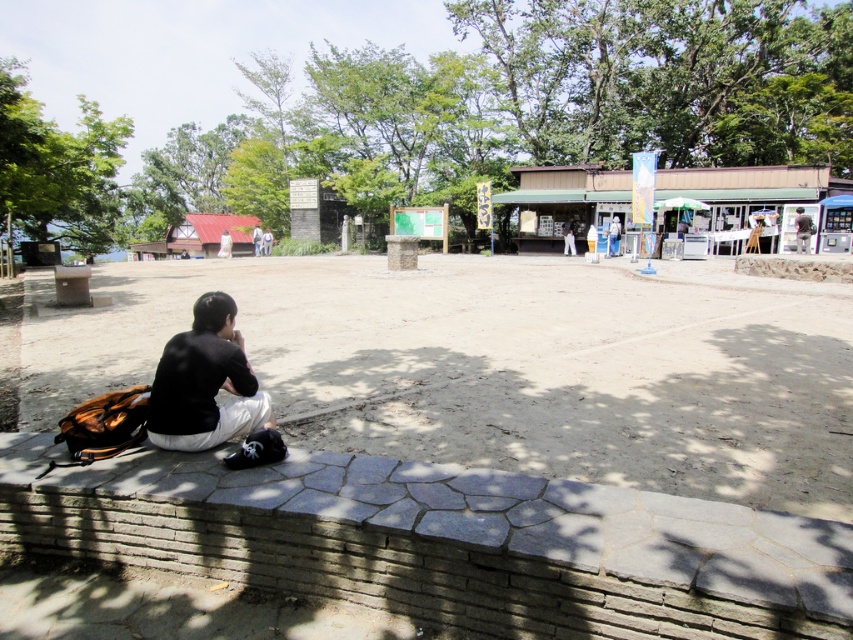
In the scene shown: Does brick at lower left have a greater width compared to black matte shirt at lower left?

Correct, the width of brick at lower left exceeds that of black matte shirt at lower left.

Does brick at lower left have a lesser width compared to black matte shirt at lower left?

In fact, brick at lower left might be wider than black matte shirt at lower left.

What do you see at coordinates (440, 541) in the screenshot? Image resolution: width=853 pixels, height=640 pixels. I see `brick at lower left` at bounding box center [440, 541].

Locate an element on the screen. The image size is (853, 640). brick at lower left is located at coordinates (440, 541).

This screenshot has height=640, width=853. What are the coordinates of `black matte shirt at lower left` in the screenshot? It's located at (207, 385).

Who is more distant from viewer, (x=189, y=342) or (x=811, y=230)?

Positioned behind is point (x=811, y=230).

At what (x,y) coordinates should I click in order to perform the action: click on black matte shirt at lower left. Please return your answer as a coordinate pair (x, y). The height and width of the screenshot is (640, 853). Looking at the image, I should click on (207, 385).

Where is `brick at lower left`? brick at lower left is located at coordinates (440, 541).

Who is more distant from viewer, (310, 561) or (811, 230)?

The point (811, 230) is more distant.

Is point (403, 481) farther from camera compared to point (809, 221)?

No.

Locate an element on the screen. The image size is (853, 640). brick at lower left is located at coordinates (440, 541).